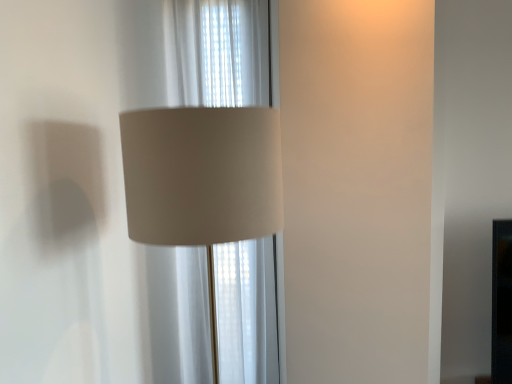
At what (x,y) coordinates should I click in order to perform the action: click on beige fabric lampshade at center. Please return your answer as a coordinate pair (x, y). Image resolution: width=512 pixels, height=384 pixels. Looking at the image, I should click on (195, 162).

The image size is (512, 384). What do you see at coordinates (195, 162) in the screenshot?
I see `beige fabric lampshade at center` at bounding box center [195, 162].

Where is `beige fabric lampshade at center`? beige fabric lampshade at center is located at coordinates (195, 162).